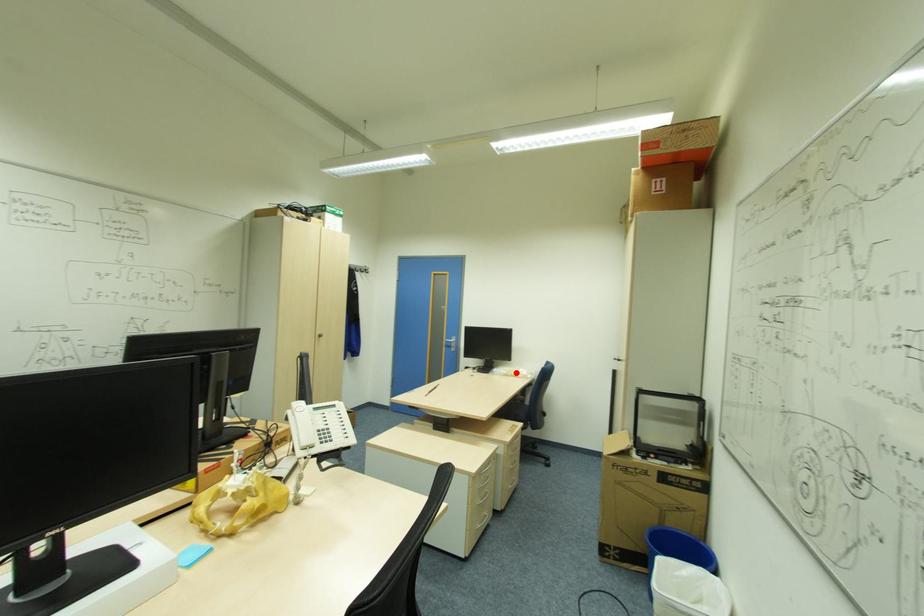
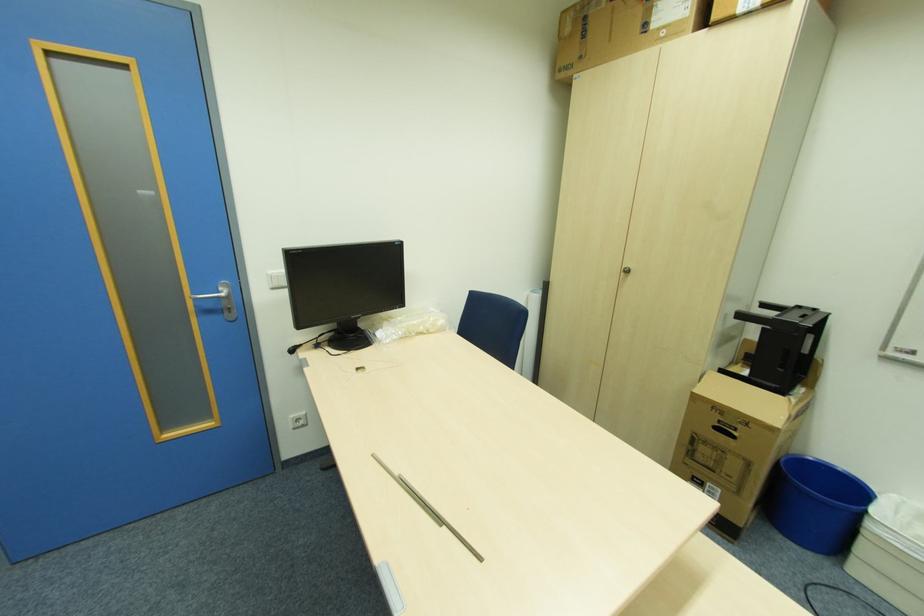
Locate, in the second image, the point that corresponds to the highlighted location in the first image.

(424, 329)